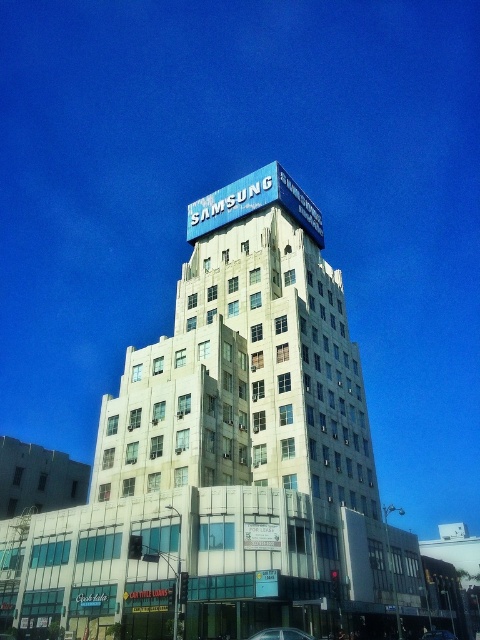
Question: Based on their relative distances, which object is farther from the shiny silver car at center?

Choices:
 (A) white glass building at center
 (B) shiny blue car at center

Answer: (A)

Question: Which point is farther from the camera taking this photo?

Choices:
 (A) (284, 634)
 (B) (436, 628)

Answer: (B)

Question: Is white glass building at center to the left of shiny silver car at center from the viewer's perspective?

Choices:
 (A) yes
 (B) no

Answer: (B)

Question: Considering the relative positions of white glass building at center and shiny silver car at center in the image provided, where is white glass building at center located with respect to shiny silver car at center?

Choices:
 (A) above
 (B) below

Answer: (B)

Question: Is white glass building at center to the left of shiny blue car at center from the viewer's perspective?

Choices:
 (A) yes
 (B) no

Answer: (B)

Question: Which point is closer to the camera?

Choices:
 (A) shiny blue car at center
 (B) white glass building at center

Answer: (B)